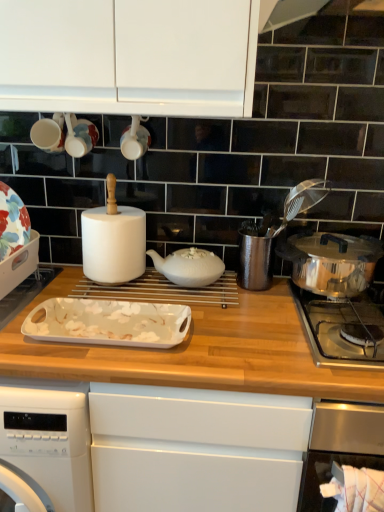
Question: Can you see polished stainless steel pot at right, placed as the third kitchen appliance when sorted from left to right, touching polished stainless steel pot at right?

Choices:
 (A) no
 (B) yes

Answer: (A)

Question: Considering the relative sizes of polished stainless steel pot at right, placed as the third kitchen appliance when sorted from left to right, and polished stainless steel pot at right in the image provided, is polished stainless steel pot at right, placed as the third kitchen appliance when sorted from left to right, thinner than polished stainless steel pot at right?

Choices:
 (A) no
 (B) yes

Answer: (B)

Question: Would you say polished stainless steel pot at right is part of polished stainless steel pot at right, placed as the third kitchen appliance when sorted from left to right,'s contents?

Choices:
 (A) no
 (B) yes

Answer: (A)

Question: From a real-world perspective, is polished stainless steel pot at right, arranged as the first kitchen appliance when viewed from the right, positioned over polished stainless steel pot at right based on gravity?

Choices:
 (A) no
 (B) yes

Answer: (B)

Question: Can you confirm if polished stainless steel pot at right, arranged as the first kitchen appliance when viewed from the right, is wider than polished stainless steel pot at right?

Choices:
 (A) yes
 (B) no

Answer: (B)

Question: From the image's perspective, is polished stainless steel pot at right located above or below polished stainless steel pot at right, arranged as the first kitchen appliance when viewed from the right?

Choices:
 (A) above
 (B) below

Answer: (B)

Question: In terms of width, does polished stainless steel pot at right look wider or thinner when compared to polished stainless steel pot at right, placed as the third kitchen appliance when sorted from left to right?

Choices:
 (A) thin
 (B) wide

Answer: (B)

Question: In terms of height, does polished stainless steel pot at right look taller or shorter compared to polished stainless steel pot at right, arranged as the first kitchen appliance when viewed from the right?

Choices:
 (A) short
 (B) tall

Answer: (A)

Question: Which is correct: polished stainless steel pot at right is inside polished stainless steel pot at right, arranged as the first kitchen appliance when viewed from the right, or outside of it?

Choices:
 (A) outside
 (B) inside

Answer: (A)

Question: Is polished stainless steel pot at right, placed as the third kitchen appliance when sorted from left to right, wider or thinner than white glossy tray at left, the 3th kitchen appliance in the right-to-left sequence?

Choices:
 (A) thin
 (B) wide

Answer: (B)

Question: Based on their sizes in the image, would you say polished stainless steel pot at right, placed as the third kitchen appliance when sorted from left to right, is bigger or smaller than white glossy tray at left, acting as the first kitchen appliance starting from the left?

Choices:
 (A) big
 (B) small

Answer: (A)

Question: Is polished stainless steel pot at right, placed as the third kitchen appliance when sorted from left to right, to the left or to the right of white glossy tray at left, the 3th kitchen appliance in the right-to-left sequence, in the image?

Choices:
 (A) left
 (B) right

Answer: (B)

Question: Considering the positions of point (309, 282) and point (23, 278), is point (309, 282) closer or farther from the camera than point (23, 278)?

Choices:
 (A) farther
 (B) closer

Answer: (B)

Question: From the image's perspective, relative to polished stainless steel pot at right, is polished stainless steel pot at right, placed as the third kitchen appliance when sorted from left to right, above or below?

Choices:
 (A) above
 (B) below

Answer: (A)

Question: Is polished stainless steel pot at right, arranged as the first kitchen appliance when viewed from the right, wider or thinner than polished stainless steel pot at right?

Choices:
 (A) thin
 (B) wide

Answer: (A)